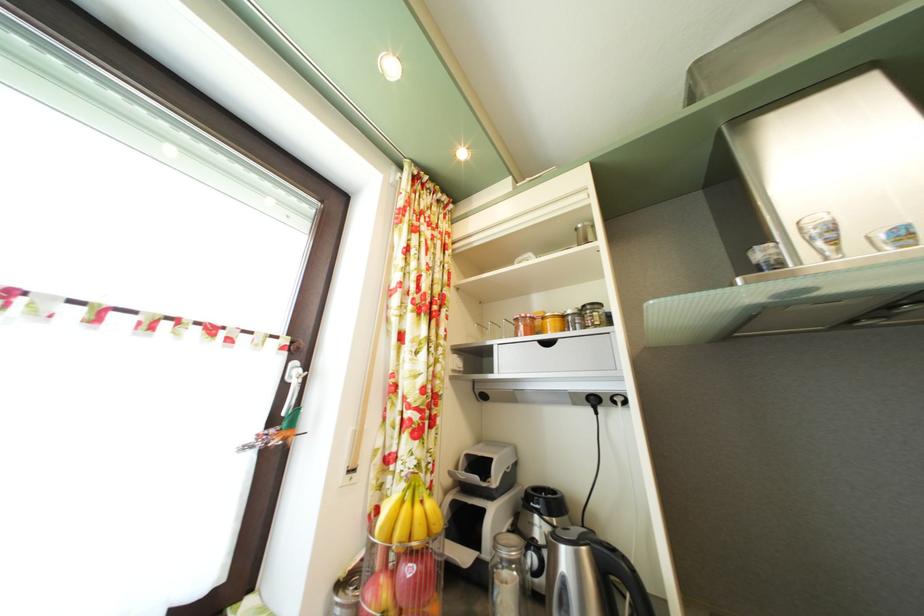
Identify the location of white window handle. (293, 385).